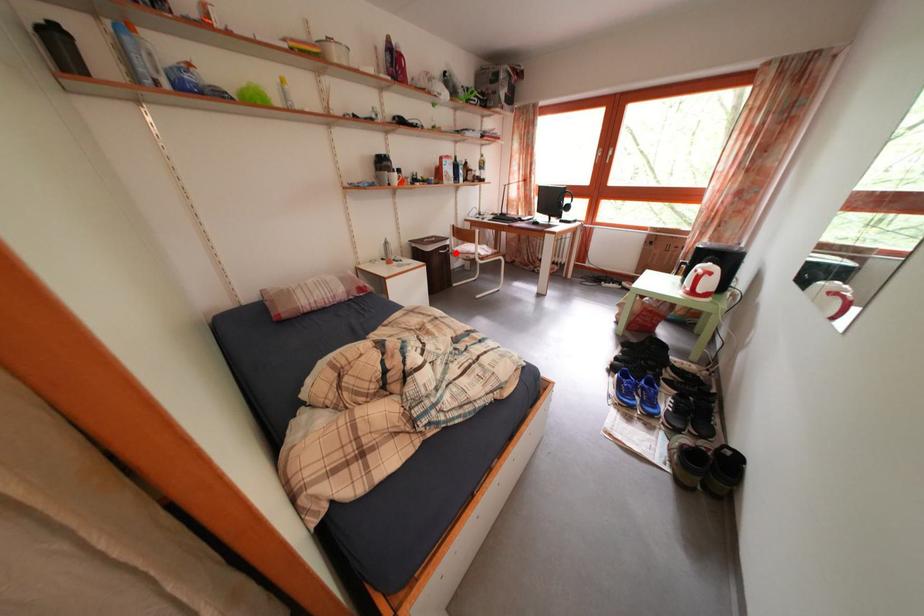
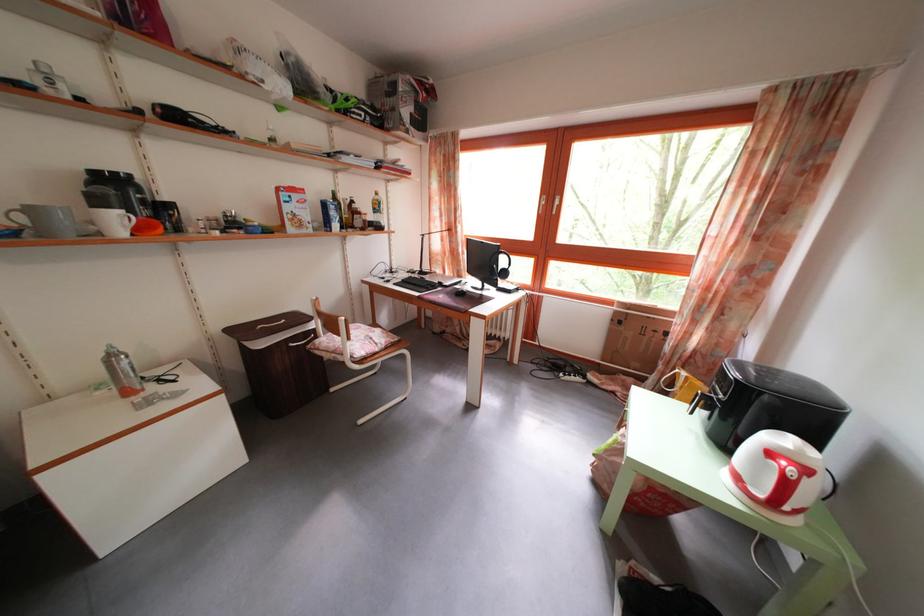
The point at the highlighted location is marked in the first image. Where is the corresponding point in the second image?

(322, 339)